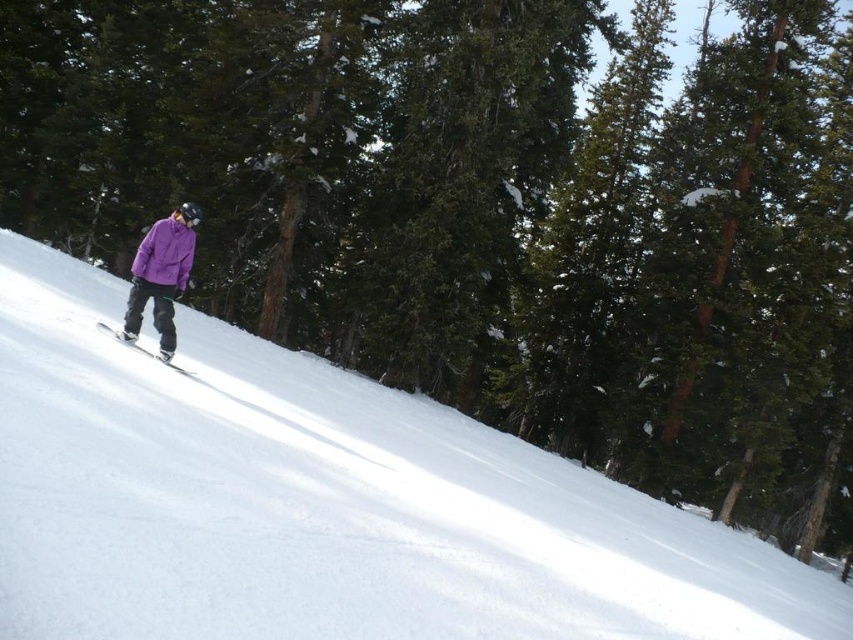
You are a snowboarder wearing the purple fleece jacket at center and want to move to the bottom of the slope. Which direction should you go relative to the white snow at center?

The white snow at center is to the right of the purple fleece jacket at center, so you should move to the right to reach the bottom of the slope.

You are a photographer trying to capture both the purple matte jacket at left and the purple fleece jacket at center in a single shot. Which jacket should you focus on first to ensure both are in the frame?

You should focus on the purple fleece jacket at center first because the purple matte jacket at left is in front of it, so adjusting the focus to include the background jacket would require a wider depth of field or repositioning.